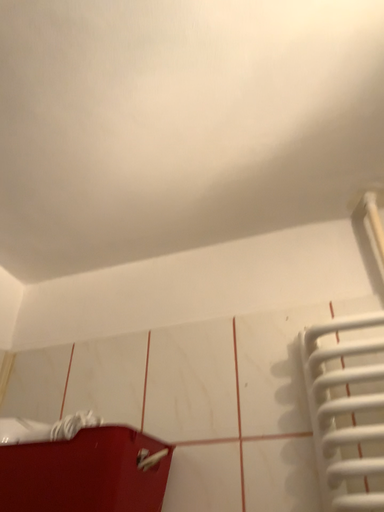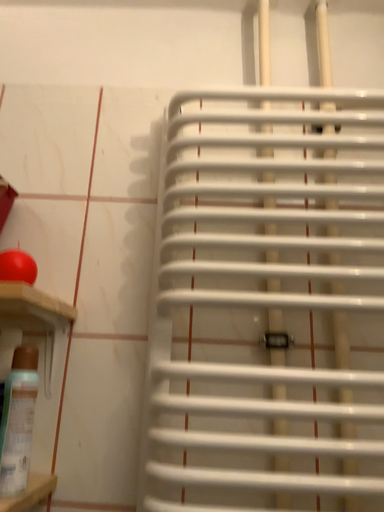
Question: Which way did the camera rotate in the video?

Choices:
 (A) rotated upward
 (B) rotated downward

Answer: (B)